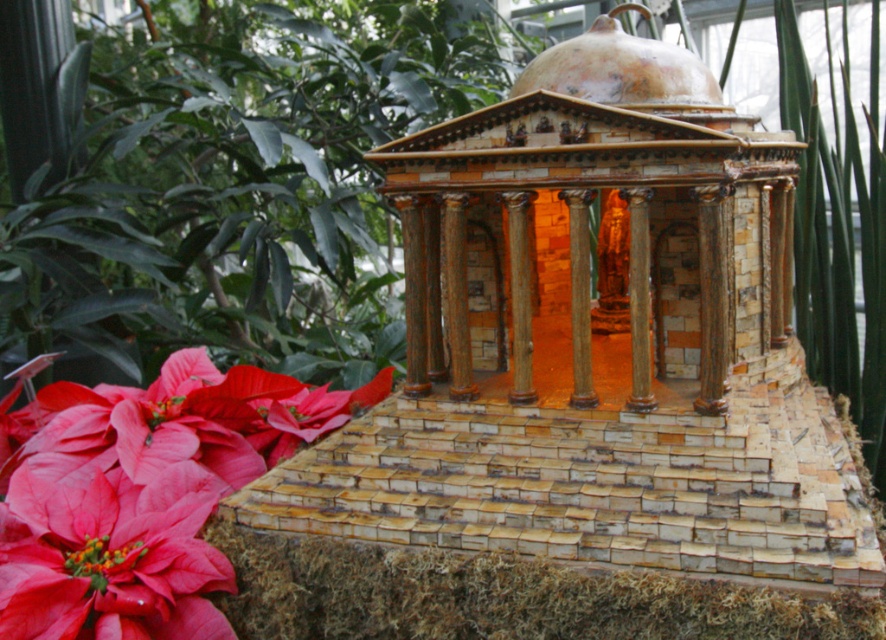
Question: Which of the following is the farthest from the observer?

Choices:
 (A) matte pink petals at lower left
 (B) matte red flower at lower left

Answer: (A)

Question: Which point is closer to the camera taking this photo?

Choices:
 (A) (188, 564)
 (B) (83, 582)

Answer: (B)

Question: Is matte pink petals at lower left smaller than matte red flower at lower left?

Choices:
 (A) no
 (B) yes

Answer: (A)

Question: Is matte pink petals at lower left wider than matte red flower at lower left?

Choices:
 (A) no
 (B) yes

Answer: (B)

Question: Is matte pink petals at lower left wider than matte red flower at lower left?

Choices:
 (A) yes
 (B) no

Answer: (A)